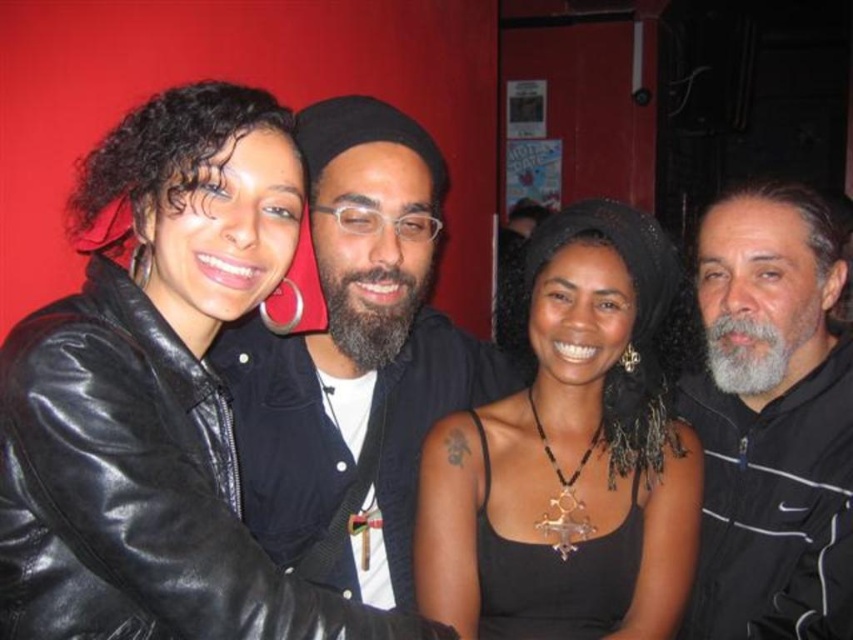
Question: Is matte black jacket at center above gray beard at right?

Choices:
 (A) yes
 (B) no

Answer: (A)

Question: Can you confirm if black leather jacket at upper left is wider than gray beard at right?

Choices:
 (A) yes
 (B) no

Answer: (A)

Question: Is black leather jacket at upper left to the right of gray beard at right from the viewer's perspective?

Choices:
 (A) yes
 (B) no

Answer: (B)

Question: Which object appears closest to the camera in this image?

Choices:
 (A) matte black jacket at center
 (B) black leather jacket at upper left
 (C) black matte tank top at center
 (D) gray beard at right

Answer: (B)

Question: Which object appears closest to the camera in this image?

Choices:
 (A) black leather jacket at upper left
 (B) gray beard at right
 (C) matte black jacket at center

Answer: (A)

Question: Which object is positioned closest to the gray beard at right?

Choices:
 (A) black leather jacket at upper left
 (B) black matte tank top at center
 (C) matte black jacket at center

Answer: (B)